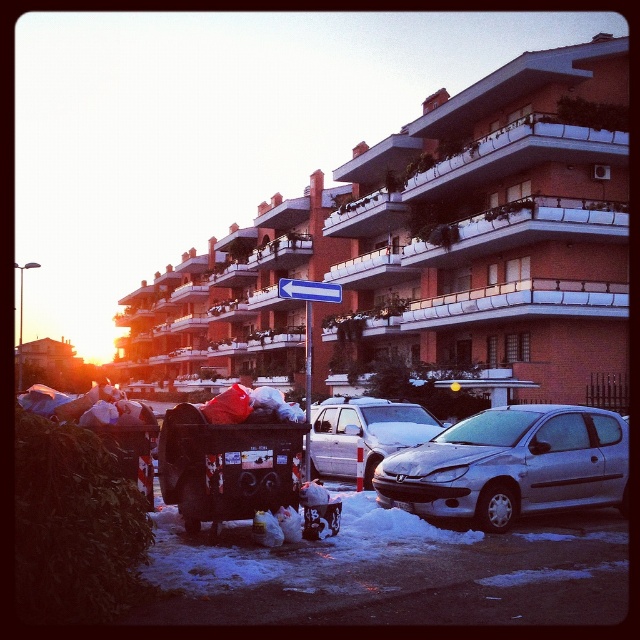
Is point (506, 406) less distant than point (356, 426)?

Yes, point (506, 406) is closer to viewer.

From the picture: Does silver metallic car at lower right have a larger size compared to satin silver car at center?

Indeed, silver metallic car at lower right has a larger size compared to satin silver car at center.

Between point (490, 452) and point (330, 419), which one is positioned in front?

Positioned in front is point (490, 452).

Identify the location of silver metallic car at lower right. (512, 465).

Who is positioned more to the left, metallic garbage cart at lower left or satin silver car at center?

From the viewer's perspective, metallic garbage cart at lower left appears more on the left side.

Can you confirm if metallic garbage cart at lower left is positioned to the left of satin silver car at center?

Indeed, metallic garbage cart at lower left is positioned on the left side of satin silver car at center.

Is point (289, 474) more distant than point (362, 429)?

No, it is in front of (362, 429).

In order to click on metallic garbage cart at lower left in this screenshot , I will do coord(227,467).

This screenshot has width=640, height=640. Describe the element at coordinates (512, 465) in the screenshot. I see `silver metallic car at lower right` at that location.

Who is lower down, silver metallic car at lower right or metallic garbage cart at lower left?

silver metallic car at lower right is below.

Between point (428, 465) and point (209, 433), which one is positioned behind?

The point (428, 465) is more distant.

Find the location of `silver metallic car at lower right`. silver metallic car at lower right is located at coordinates (512, 465).